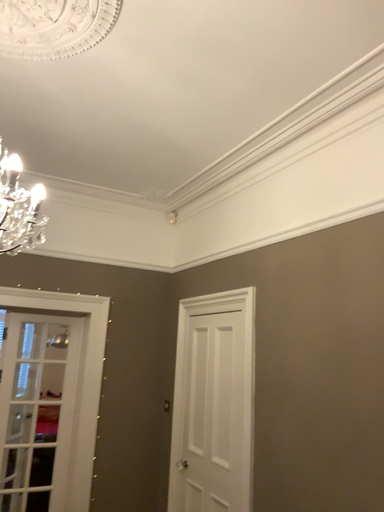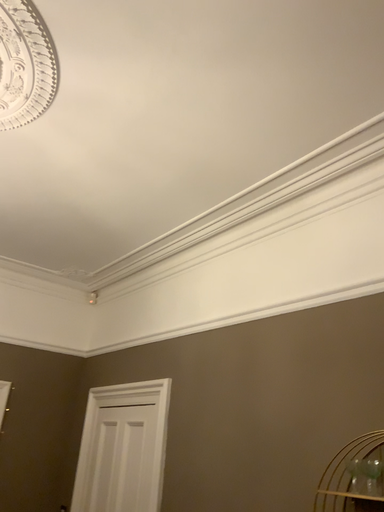
Question: Which way did the camera rotate in the video?

Choices:
 (A) rotated left
 (B) rotated right

Answer: (B)